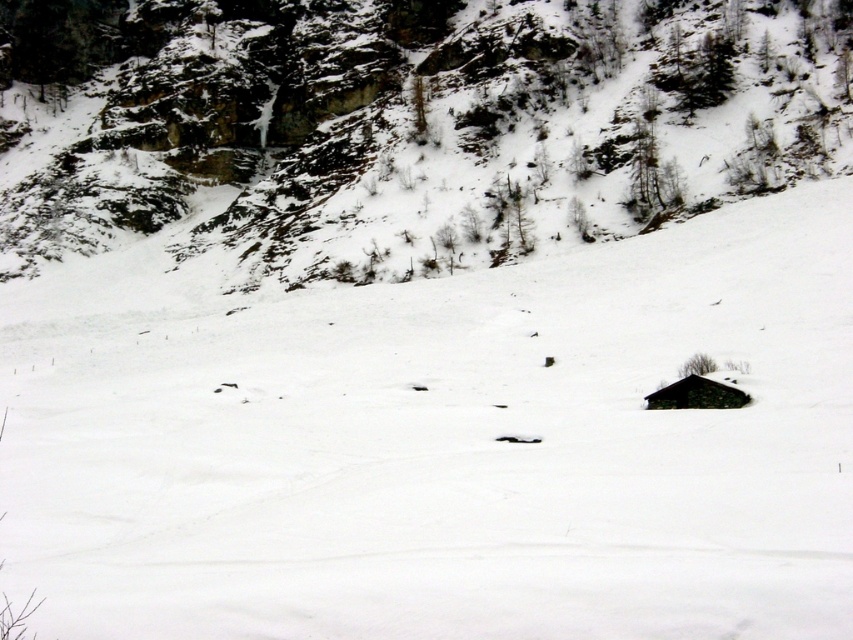
Is point (151, 193) in front of point (657, 404)?

No, (151, 193) is behind (657, 404).

Which is more to the right, rocky cliff at upper left or stone roof hut at lower right?

stone roof hut at lower right

Describe the element at coordinates (421, 131) in the screenshot. I see `rocky cliff at upper left` at that location.

Where is `rocky cliff at upper left`? Image resolution: width=853 pixels, height=640 pixels. rocky cliff at upper left is located at coordinates (421, 131).

Which is more to the right, white matte snow at center or rocky cliff at upper left?

white matte snow at center

Is white matte snow at center thinner than rocky cliff at upper left?

Yes, white matte snow at center is thinner than rocky cliff at upper left.

Where is `white matte snow at center`? The width and height of the screenshot is (853, 640). white matte snow at center is located at coordinates (447, 445).

Find the location of `white matte snow at center`. white matte snow at center is located at coordinates (447, 445).

Which of these two, white matte snow at center or stone roof hut at lower right, stands taller?

white matte snow at center is taller.

Which is more to the right, white matte snow at center or stone roof hut at lower right?

stone roof hut at lower right is more to the right.

Image resolution: width=853 pixels, height=640 pixels. Find the location of `white matte snow at center`. white matte snow at center is located at coordinates 447,445.

Locate an element on the screen. white matte snow at center is located at coordinates (447, 445).